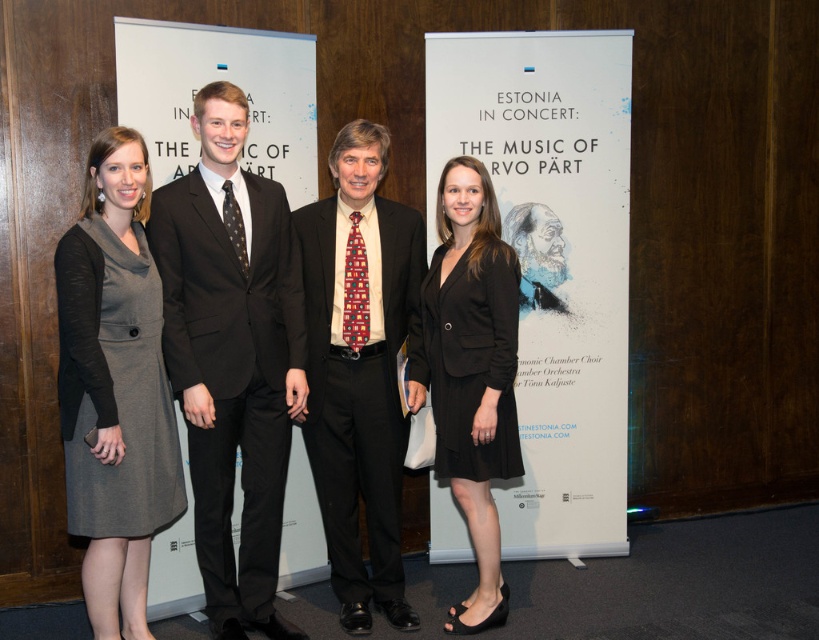
Can you confirm if black satin suit at center is taller than multicolored woven tie at center?

Correct, black satin suit at center is much taller as multicolored woven tie at center.

Between point (173, 380) and point (362, 308), which one is positioned in front?

Point (173, 380) is more forward.

I want to click on black satin suit at center, so click(x=232, y=358).

Is point (87, 262) more distant than point (355, 449)?

No.

Who is positioned more to the left, gray wool dress at left or black wool suit at center?

Positioned to the left is gray wool dress at left.

Does point (88, 154) lie in front of point (394, 205)?

Yes, point (88, 154) is in front of point (394, 205).

This screenshot has width=819, height=640. Find the location of `gray wool dress at left`. gray wool dress at left is located at coordinates [x=114, y=387].

How distant is gray wool dress at left from multicolored woven tie at center?

They are 34.59 inches apart.

Does gray wool dress at left have a smaller size compared to multicolored woven tie at center?

Actually, gray wool dress at left might be larger than multicolored woven tie at center.

Does point (94, 474) come behind point (349, 252)?

No, it is not.

You are a GUI agent. You are given a task and a screenshot of the screen. Output one action in this format:
    pyautogui.click(x=<x>, y=<y>)
    Task: Click on the gray wool dress at left
    This screenshot has width=819, height=640.
    Given the screenshot: What is the action you would take?
    pyautogui.click(x=114, y=387)